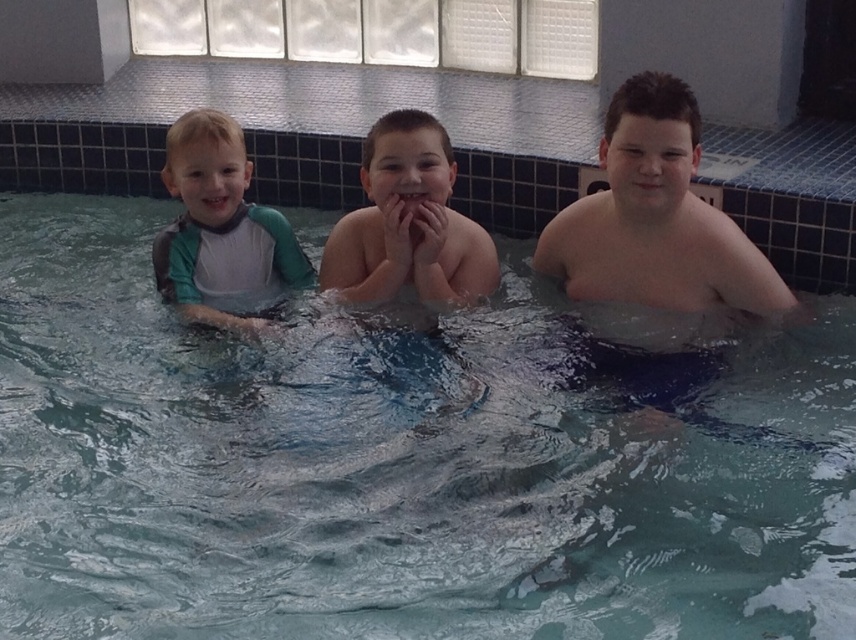
You are a lifeguard standing at the edge of the pool. You need to assess if the clear blue water at center can fully cover the smooth skin boy at right. Based on the size comparison provided, what is your conclusion?

The clear blue water at center is larger in size than the smooth skin boy at right, so it can fully cover him.